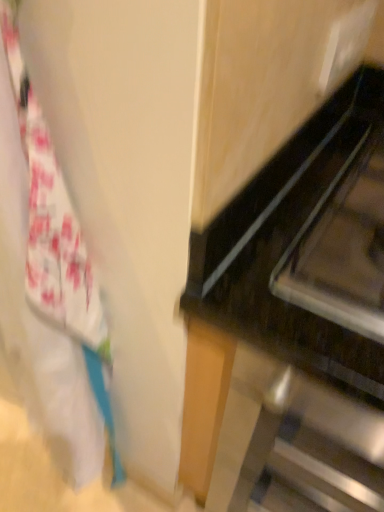
What is the approximate width of white fabric at left?

The width of white fabric at left is 7.15 inches.

This screenshot has width=384, height=512. Find the location of `white fabric at left`. white fabric at left is located at coordinates (49, 284).

The height and width of the screenshot is (512, 384). What do you see at coordinates (49, 284) in the screenshot?
I see `white fabric at left` at bounding box center [49, 284].

The width and height of the screenshot is (384, 512). What do you see at coordinates (303, 310) in the screenshot?
I see `black glossy oven at right` at bounding box center [303, 310].

Locate an element on the screen. black glossy oven at right is located at coordinates (303, 310).

The height and width of the screenshot is (512, 384). Identify the location of white fabric at left. (49, 284).

Can you confirm if black glossy oven at right is positioned to the left of white fabric at left?

Incorrect, black glossy oven at right is not on the left side of white fabric at left.

Considering the relative positions of black glossy oven at right and white fabric at left in the image provided, is black glossy oven at right in front of white fabric at left?

Answer: No.

Between point (379, 508) and point (1, 68), which one is positioned in front?

The point (1, 68) is in front.

From the image's perspective, which is below, black glossy oven at right or white fabric at left?

black glossy oven at right appears lower in the image.

From a real-world perspective, which is physically above, black glossy oven at right or white fabric at left?

white fabric at left, from a real-world perspective.

Considering the relative sizes of black glossy oven at right and white fabric at left in the image provided, is black glossy oven at right wider than white fabric at left?

Indeed, black glossy oven at right has a greater width compared to white fabric at left.

Considering the sizes of objects black glossy oven at right and white fabric at left in the image provided, who is taller, black glossy oven at right or white fabric at left?

white fabric at left.

Considering the sizes of black glossy oven at right and white fabric at left in the image, is black glossy oven at right bigger or smaller than white fabric at left?

Clearly, black glossy oven at right is larger in size than white fabric at left.

Would you say white fabric at left is part of black glossy oven at right's contents?

Definitely not — white fabric at left is not inside black glossy oven at right.

Can you see black glossy oven at right touching white fabric at left?

No, black glossy oven at right is not beside white fabric at left.

Is black glossy oven at right turned away from white fabric at left?

No.

Locate an element on the screen. This screenshot has width=384, height=512. laundry above the black glossy oven at right (from the image's perspective) is located at coordinates (49, 284).

Does white fabric at left appear on the left side of black glossy oven at right?

Indeed, white fabric at left is positioned on the left side of black glossy oven at right.

Between white fabric at left and black glossy oven at right, which one is positioned in front?

white fabric at left is in front.

Is point (81, 384) in front of point (245, 477)?

Yes, point (81, 384) is closer to viewer.

From the image's perspective, relative to black glossy oven at right, is white fabric at left above or below?

white fabric at left is above black glossy oven at right.

Consider the image. From a real-world perspective, which is physically below, white fabric at left or black glossy oven at right?

black glossy oven at right, from a real-world perspective.

Can you confirm if white fabric at left is thinner than black glossy oven at right?

Yes.

From their relative heights in the image, would you say white fabric at left is taller or shorter than black glossy oven at right?

Clearly, white fabric at left is taller compared to black glossy oven at right.

Who is smaller, white fabric at left or black glossy oven at right?

white fabric at left.

Which is correct: white fabric at left is inside black glossy oven at right, or outside of it?

white fabric at left is located beyond the bounds of black glossy oven at right.

Is white fabric at left not near black glossy oven at right?

No, white fabric at left is in close proximity to black glossy oven at right.

In the scene shown: Is white fabric at left oriented away from black glossy oven at right?

No, white fabric at left's orientation is not away from black glossy oven at right.

Can you tell me how much white fabric at left and black glossy oven at right differ in facing direction?

The angular difference between white fabric at left and black glossy oven at right is 0.0928 degrees.

This screenshot has height=512, width=384. I want to click on laundry in front of the black glossy oven at right, so click(x=49, y=284).

Locate an element on the screen. Image resolution: width=384 pixels, height=512 pixels. furniture below the white fabric at left (from the image's perspective) is located at coordinates (303, 310).

Find the location of a particular element. The width and height of the screenshot is (384, 512). laundry above the black glossy oven at right (from the image's perspective) is located at coordinates (49, 284).